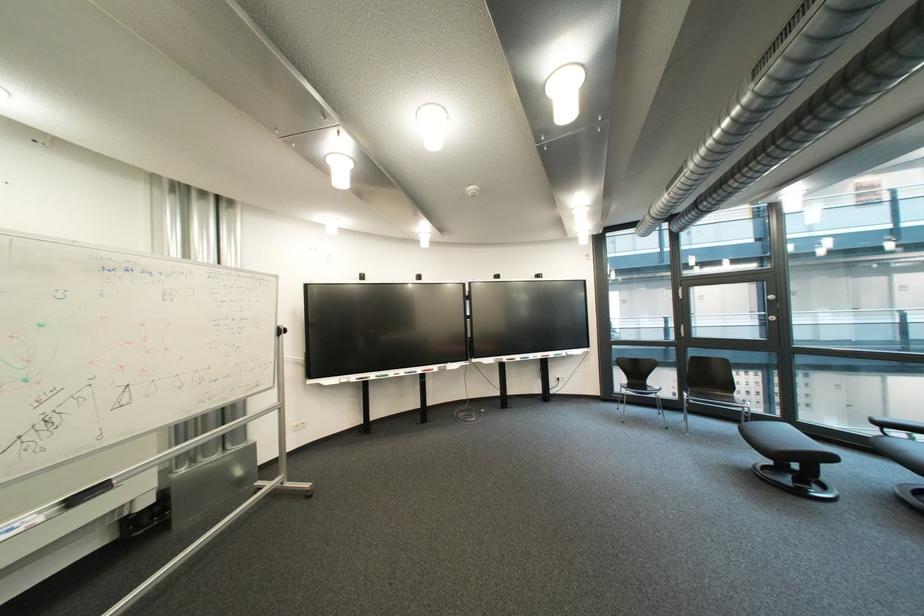
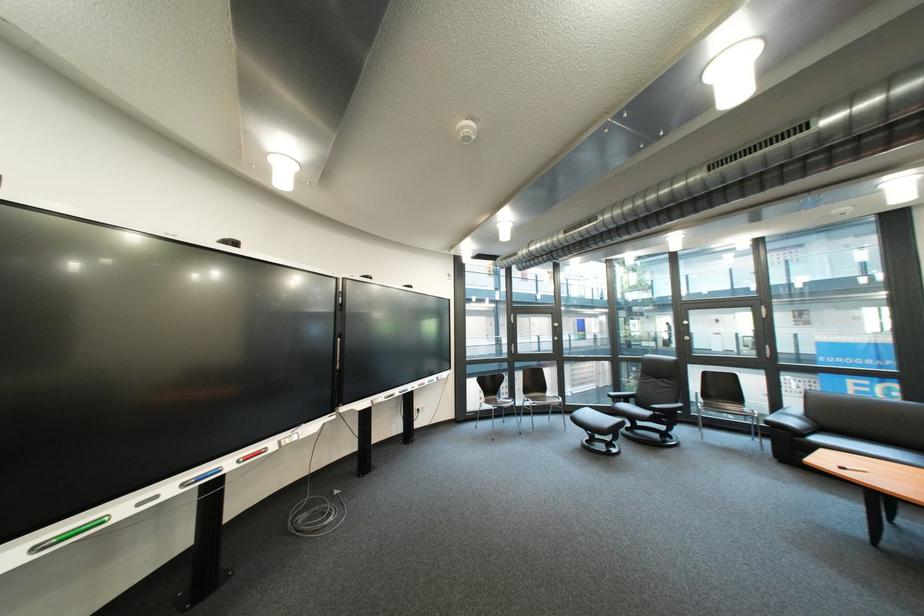
Where in the second image is the point corresponding to (x=781, y=468) from the first image?

(601, 443)